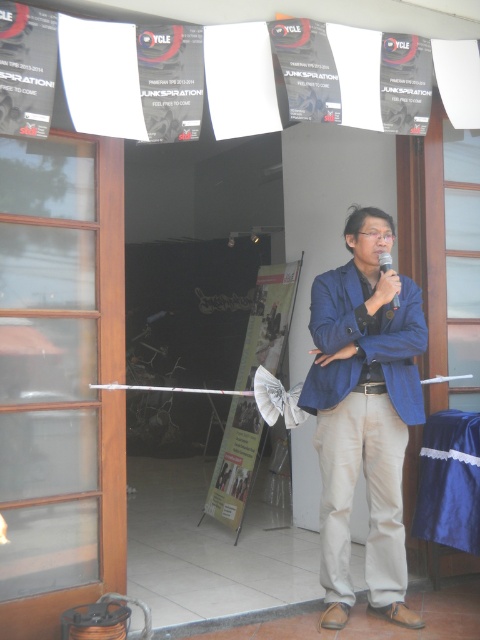
Can you confirm if khaki pants at center is taller than matte blue jacket at center?

Yes, khaki pants at center is taller than matte blue jacket at center.

Can you confirm if khaki pants at center is shorter than matte blue jacket at center?

In fact, khaki pants at center may be taller than matte blue jacket at center.

Is point (382, 449) positioned in front of point (342, 362)?

Yes, point (382, 449) is closer to viewer.

This screenshot has width=480, height=640. I want to click on khaki pants at center, so click(x=367, y=496).

Which is below, blue fabric jacket at center or matte blue jacket at center?

blue fabric jacket at center

Between point (325, 488) and point (346, 312), which one is positioned in front?

Positioned in front is point (325, 488).

Where is `blue fabric jacket at center`? This screenshot has height=640, width=480. blue fabric jacket at center is located at coordinates (363, 413).

Is matte blue jacket at center smaller than black plastic microphone at center?

Incorrect, matte blue jacket at center is not smaller in size than black plastic microphone at center.

Does matte blue jacket at center have a lesser width compared to black plastic microphone at center?

No.

What do you see at coordinates (364, 342) in the screenshot? I see `matte blue jacket at center` at bounding box center [364, 342].

Where is `matte blue jacket at center`? The height and width of the screenshot is (640, 480). matte blue jacket at center is located at coordinates tap(364, 342).